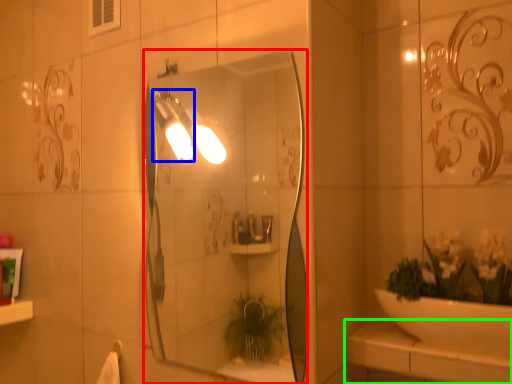
Question: Based on their relative distances, which object is farther from mirror (highlighted by a red box)? Choose from light fixture (highlighted by a blue box) and counter top (highlighted by a green box).

Choices:
 (A) light fixture
 (B) counter top

Answer: (B)